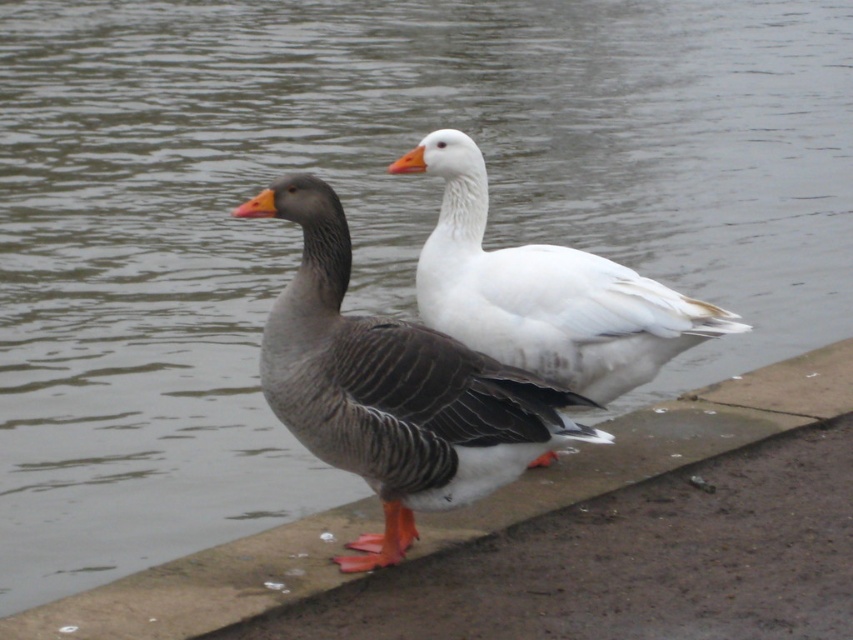
You are a birdwatcher observing two birds at a pond. You see the gray matte duck at center and the white matte goose at center. Which one is located to the left?

The gray matte duck at center is positioned on the left side of the white matte goose at center, so the gray matte duck at center is the one located to the left.

You are a wildlife photographer aiming to capture a photo of the white matte goose at center. You need to position your camera at the origin point. What are the coordinates you should aim for to ensure the goose is centered in your shot?

The white matte goose at center is located at coordinates point [544,291], so you should aim your camera at those coordinates to center the goose in your photo.

You are standing at the edge of the water and see the point marked at coordinates [392,387]. What object is located at that point?

The point at coordinates [392,387] marks the location of the gray matte duck at center.